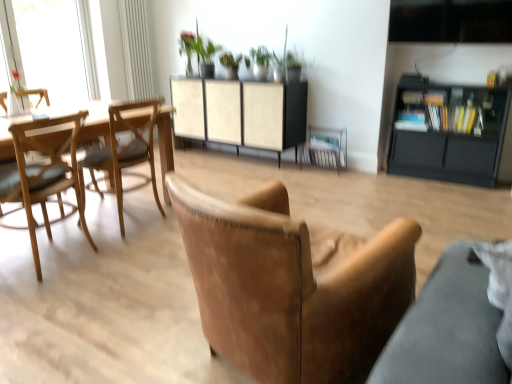
Question: From the image's perspective, is black matte cabinet at right, which is the 1th cabinetry in right-to-left order, on top of light brown wood chair at left, which is the 2th chair from right to left?

Choices:
 (A) yes
 (B) no

Answer: (A)

Question: From a real-world perspective, is black matte cabinet at right, which is the 1th cabinetry in right-to-left order, over light brown wood chair at left, which is the second chair from left to right?

Choices:
 (A) no
 (B) yes

Answer: (A)

Question: Does black matte cabinet at right, acting as the 2th cabinetry starting from the left, appear on the right side of light brown wood chair at left, which is the second chair from left to right?

Choices:
 (A) yes
 (B) no

Answer: (A)

Question: Considering the relative positions of black matte cabinet at right, acting as the 2th cabinetry starting from the left, and light brown wood chair at left, which is the 2th chair from right to left, in the image provided, is black matte cabinet at right, acting as the 2th cabinetry starting from the left, in front of light brown wood chair at left, which is the 2th chair from right to left,?

Choices:
 (A) no
 (B) yes

Answer: (A)

Question: Is black matte cabinet at right, acting as the 2th cabinetry starting from the left, outside of light brown wood chair at left, which is the 2th chair from right to left?

Choices:
 (A) yes
 (B) no

Answer: (A)

Question: From a real-world perspective, is black matte cabinet at right, which is the 1th cabinetry in right-to-left order, below light brown wood chair at left, which is the second chair from left to right?

Choices:
 (A) yes
 (B) no

Answer: (A)

Question: From the image's perspective, does woodenmaterial/texturetable at left appear lower than light brown wood chair at left, which is the 2th chair from right to left?

Choices:
 (A) yes
 (B) no

Answer: (A)

Question: Would you say woodenmaterial/texturetable at left is outside light brown wood chair at left, which is the second chair from left to right?

Choices:
 (A) yes
 (B) no

Answer: (A)

Question: Can you confirm if woodenmaterial/texturetable at left is positioned to the left of light brown wood chair at left, which is the second chair from left to right?

Choices:
 (A) no
 (B) yes

Answer: (B)

Question: Can you confirm if woodenmaterial/texturetable at left is thinner than light brown wood chair at left, which is the second chair from left to right?

Choices:
 (A) yes
 (B) no

Answer: (B)

Question: Is woodenmaterial/texturetable at left to the right of light brown wood chair at left, which is the second chair from left to right, from the viewer's perspective?

Choices:
 (A) no
 (B) yes

Answer: (A)

Question: Does woodenmaterial/texturetable at left come in front of light brown wood chair at left, which is the 2th chair from right to left?

Choices:
 (A) yes
 (B) no

Answer: (A)

Question: Is light brown wooden chair at left, placed as the first chair when sorted from left to right, far from green matte plant at upper center?

Choices:
 (A) yes
 (B) no

Answer: (A)